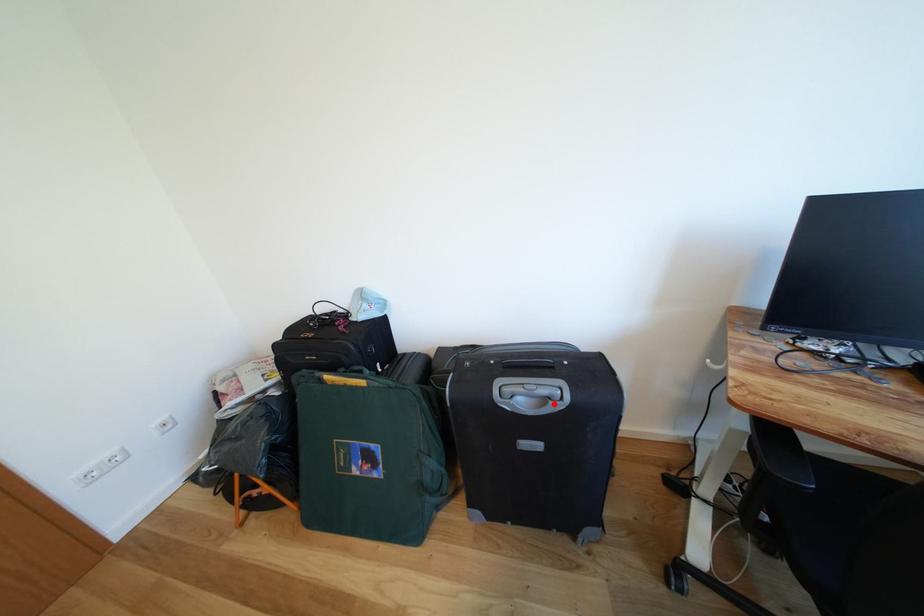
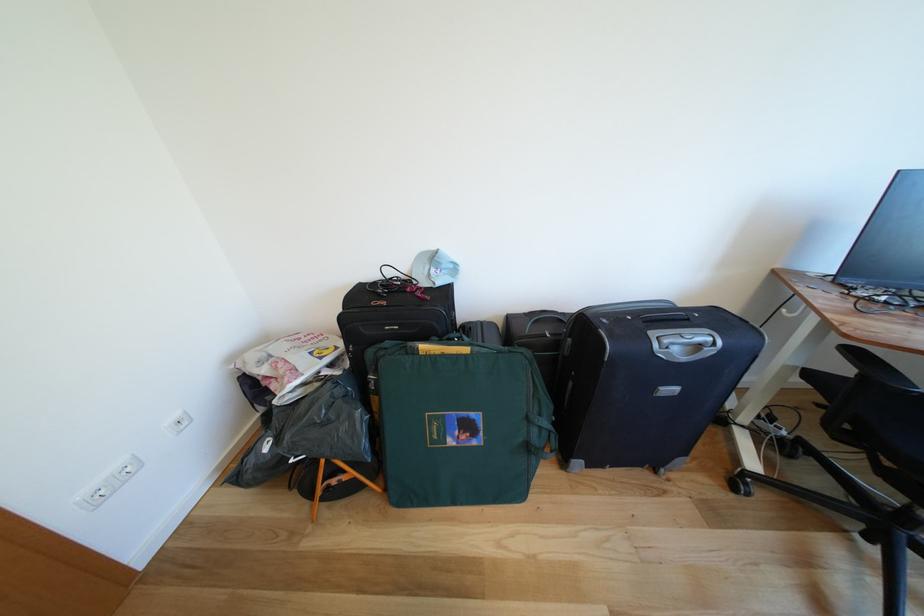
Question: I am providing you with two images of the same scene from different viewpoints. A red point is marked on the first image. Can you still see the location of the red point in image 2?

Choices:
 (A) Yes
 (B) No

Answer: (A)